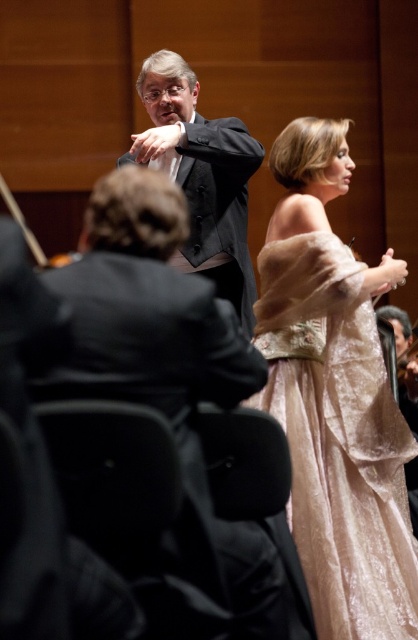
Question: Which point is closer to the camera?

Choices:
 (A) dark gray suit at center
 (B) velvet beige gown at center

Answer: (B)

Question: Is velvet beige gown at center above dark gray suit at center?

Choices:
 (A) no
 (B) yes

Answer: (A)

Question: Is velvet beige gown at center to the right of dark gray suit at center from the viewer's perspective?

Choices:
 (A) yes
 (B) no

Answer: (A)

Question: Which of the following is the closest to the observer?

Choices:
 (A) matte black suit at center
 (B) velvet beige gown at center
 (C) dark gray suit at center

Answer: (A)

Question: Is matte black suit at center smaller than dark gray suit at center?

Choices:
 (A) no
 (B) yes

Answer: (B)

Question: Which of these objects is positioned closest to the dark gray suit at center?

Choices:
 (A) velvet beige gown at center
 (B) matte black suit at center

Answer: (A)